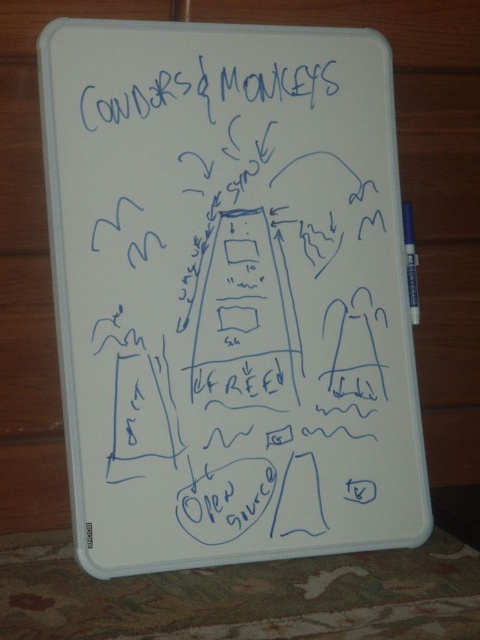
Can you confirm if white matte whiteboard at center is thinner than blue ink writing at upper center?

No, white matte whiteboard at center is not thinner than blue ink writing at upper center.

Which is more to the left, white matte whiteboard at center or blue ink writing at upper center?

From the viewer's perspective, blue ink writing at upper center appears more on the left side.

Where is `white matte whiteboard at center`? This screenshot has height=640, width=480. white matte whiteboard at center is located at coordinates (228, 292).

Locate an element on the screen. The height and width of the screenshot is (640, 480). white matte whiteboard at center is located at coordinates (228, 292).

Does blue ink writing at upper center have a lesser height compared to white plastic pen at right?

Yes, blue ink writing at upper center is shorter than white plastic pen at right.

Describe the element at coordinates (207, 90) in the screenshot. I see `blue ink writing at upper center` at that location.

Where is `blue ink writing at upper center`? blue ink writing at upper center is located at coordinates (207, 90).

Is white matte whiteboard at center taller than white plastic pen at right?

Yes, white matte whiteboard at center is taller than white plastic pen at right.

You are a GUI agent. You are given a task and a screenshot of the screen. Output one action in this format:
    pyautogui.click(x=<x>, y=<y>)
    Task: Click on the white matte whiteboard at center
    This screenshot has height=640, width=480.
    Given the screenshot: What is the action you would take?
    tap(228, 292)